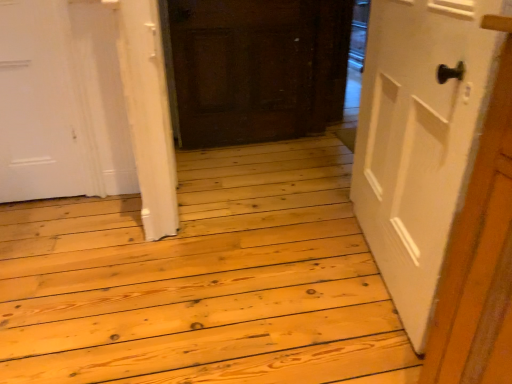
Locate an element on the screen. vacant space underneath white matte door at right, the second door from the back (from a real-world perspective) is located at coordinates (373, 276).